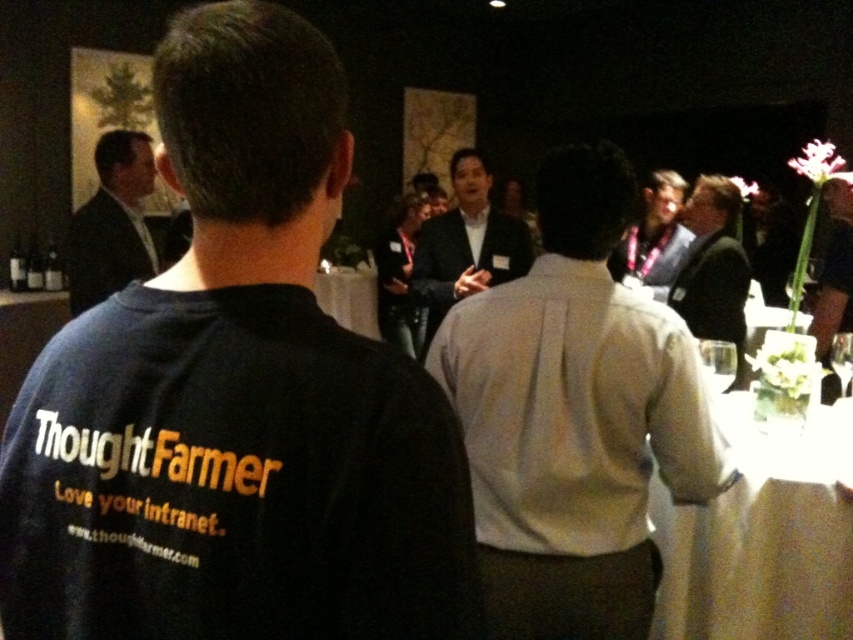
You are standing at the center of the room and want to locate the light brown leather jacket at upper right. According to the coordinates, in which direction should you look to find it?

The light brown leather jacket at upper right is located at coordinates point (654, 237), which means it is positioned to the upper right from your current position at the center of the room.

You are at the event and want to approach the person in the dark gray suit at center. Which direction should you move to reach them from the white shirt at center?

The white shirt at center is to the right of the dark gray suit at center, so you should move to the left to reach the dark gray suit at center from the white shirt at center.